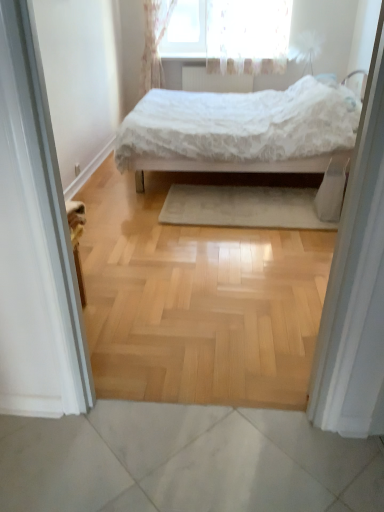
In order to face white fabric screen door at right, acting as the 2th screen door starting from the left, should I rotate leftwards or rightwards?

You should look right and rotate roughly 21.331 degrees.

What do you see at coordinates (154, 44) in the screenshot? I see `white lace curtain at upper center` at bounding box center [154, 44].

Measure the distance between beige soft rug at center and camera.

The distance of beige soft rug at center from camera is 2.88 meters.

Image resolution: width=384 pixels, height=512 pixels. In order to click on white fabric screen door at right, positioned as the first screen door in right-to-left order in this screenshot , I will do `click(356, 284)`.

Would you consider beige soft rug at center to be distant from white fabric screen door at right, acting as the 2th screen door starting from the left?

Yes, beige soft rug at center and white fabric screen door at right, acting as the 2th screen door starting from the left, are quite far apart.

Does beige soft rug at center have a greater width compared to white fabric screen door at right, positioned as the first screen door in right-to-left order?

Correct, the width of beige soft rug at center exceeds that of white fabric screen door at right, positioned as the first screen door in right-to-left order.

Does beige soft rug at center lie behind white fabric screen door at right, positioned as the first screen door in right-to-left order?

That is True.

Who is taller, beige soft rug at center or white fabric screen door at right, acting as the 2th screen door starting from the left?

white fabric screen door at right, acting as the 2th screen door starting from the left, is taller.

What's the angular difference between white lace bed at center and white textured radiator at upper center's facing directions?

91.1 degrees separate the facing orientations of white lace bed at center and white textured radiator at upper center.

Is white lace bed at center aimed at white textured radiator at upper center?

No, white lace bed at center is not aimed at white textured radiator at upper center.

Considering the relative sizes of white lace bed at center and white textured radiator at upper center in the image provided, is white lace bed at center shorter than white textured radiator at upper center?

In fact, white lace bed at center may be taller than white textured radiator at upper center.

How much distance is there between white lace bed at center and white textured radiator at upper center?

white lace bed at center is 2.42 meters from white textured radiator at upper center.

Choose the correct answer: Is white lace curtain at upper center inside white lace bed at center or outside it?

The correct answer is: outside.

Is white lace curtain at upper center taller than white lace bed at center?

Indeed, white lace curtain at upper center has a greater height compared to white lace bed at center.

Can you tell me how much white lace curtain at upper center and white lace bed at center differ in facing direction?

The facing directions of white lace curtain at upper center and white lace bed at center are 91.1 degrees apart.

From a real-world perspective, between white lace curtain at upper center and white lace bed at center, who is vertically higher?

From a 3D spatial view, white lace curtain at upper center is above.

Can you confirm if transparent floral curtain at upper center is thinner than white fabric screen door at right, positioned as the first screen door in right-to-left order?

Indeed, transparent floral curtain at upper center has a lesser width compared to white fabric screen door at right, positioned as the first screen door in right-to-left order.

At what (x,y) coordinates should I click in order to perform the action: click on screen door to the right of transparent floral curtain at upper center. Please return your answer as a coordinate pair (x, y). This screenshot has height=512, width=384. Looking at the image, I should click on (356, 284).

From the picture: Does transparent floral curtain at upper center turn towards white fabric screen door at right, acting as the 2th screen door starting from the left?

Yes, transparent floral curtain at upper center is facing white fabric screen door at right, acting as the 2th screen door starting from the left.

Does transparent floral curtain at upper center lie behind white fabric screen door at right, acting as the 2th screen door starting from the left?

Yes, the depth of transparent floral curtain at upper center is greater than that of white fabric screen door at right, acting as the 2th screen door starting from the left.

This screenshot has width=384, height=512. I want to click on radiator below the white lace curtain at upper center (from the image's perspective), so click(x=214, y=81).

From the image's perspective, does white lace curtain at upper center appear higher than white textured radiator at upper center?

Yes, from the image's perspective, white lace curtain at upper center is over white textured radiator at upper center.

Does point (160, 70) come farther from viewer compared to point (226, 80)?

No.

Would you say white lace curtain at upper center is a long distance from white textured radiator at upper center?

They are positioned close to each other.

Is white lace bed at center turned away from beige soft rug at center?

That's not correct — white lace bed at center is not looking away from beige soft rug at center.

Considering the sizes of white lace bed at center and beige soft rug at center in the image, is white lace bed at center taller or shorter than beige soft rug at center?

Clearly, white lace bed at center is taller compared to beige soft rug at center.

From a real-world perspective, which is physically above, white lace bed at center or beige soft rug at center?

In real-world perspective, white lace bed at center is above.

Is white fabric screen door at right, acting as the 2th screen door starting from the left, positioned behind beige soft rug at center?

No, white fabric screen door at right, acting as the 2th screen door starting from the left, is closer to the camera.

The image size is (384, 512). What are the coordinates of `the 1st screen door in front of the beige soft rug at center` in the screenshot? It's located at (356, 284).

In the scene shown: Is white fabric screen door at right, acting as the 2th screen door starting from the left, positioned far away from beige soft rug at center?

white fabric screen door at right, acting as the 2th screen door starting from the left, is far away from beige soft rug at center.

Considering the sizes of objects white fabric screen door at right, positioned as the first screen door in right-to-left order, and beige soft rug at center in the image provided, who is bigger, white fabric screen door at right, positioned as the first screen door in right-to-left order, or beige soft rug at center?

With larger size is white fabric screen door at right, positioned as the first screen door in right-to-left order.

Find the location of a particular element. screen door to the right of beige soft rug at center is located at coordinates (356, 284).

This screenshot has height=512, width=384. In order to click on bed directly beneath the white textured radiator at upper center (from a real-world perspective) in this screenshot , I will do `click(239, 129)`.

Consider the image. Considering their positions, is white fabric screen door at left, the 1th screen door from the left, positioned closer to white textured radiator at upper center than transparent floral curtain at upper center?

transparent floral curtain at upper center is positioned closer to the anchor white textured radiator at upper center.

From the image, which object appears to be nearer to beige soft rug at center, white textured radiator at upper center or white fabric screen door at right, positioned as the first screen door in right-to-left order?

white fabric screen door at right, positioned as the first screen door in right-to-left order, lies closer to beige soft rug at center than the other object.

Estimate the real-world distances between objects in this image. Which object is closer to white lace curtain at upper center, white lace bed at center or transparent floral curtain at upper center?

transparent floral curtain at upper center is positioned closer to the anchor white lace curtain at upper center.

From the image, which object appears to be nearer to transparent floral curtain at upper center, white textured radiator at upper center or white lace curtain at upper center?

The object closer to transparent floral curtain at upper center is white textured radiator at upper center.

Considering their positions, is white textured radiator at upper center positioned further to beige soft rug at center than white lace curtain at upper center?

white textured radiator at upper center lies further to beige soft rug at center than the other object.

When comparing their distances from beige soft rug at center, does white fabric screen door at right, positioned as the first screen door in right-to-left order, or white lace bed at center seem closer?

white lace bed at center.

Considering their positions, is beige soft rug at center positioned closer to white fabric screen door at right, positioned as the first screen door in right-to-left order, than white lace curtain at upper center?

The object closer to white fabric screen door at right, positioned as the first screen door in right-to-left order, is beige soft rug at center.

From the image, which object appears to be farther from white fabric screen door at left, the 2th screen door positioned from the right, transparent floral curtain at upper center or white textured radiator at upper center?

transparent floral curtain at upper center is further to white fabric screen door at left, the 2th screen door positioned from the right.

I want to click on bed between transparent floral curtain at upper center and beige soft rug at center in the vertical direction, so click(x=239, y=129).

The height and width of the screenshot is (512, 384). In order to click on screen door located between white fabric screen door at left, the 1th screen door from the left, and white lace curtain at upper center in the depth direction in this screenshot , I will do `click(356, 284)`.

At what (x,y) coordinates should I click in order to perform the action: click on mat located between white fabric screen door at right, positioned as the first screen door in right-to-left order, and white textured radiator at upper center in the depth direction. Please return your answer as a coordinate pair (x, y). This screenshot has height=512, width=384. Looking at the image, I should click on tap(242, 207).

Identify the location of screen door between white fabric screen door at left, the 2th screen door positioned from the right, and white lace bed at center, along the z-axis. The image size is (384, 512). (356, 284).